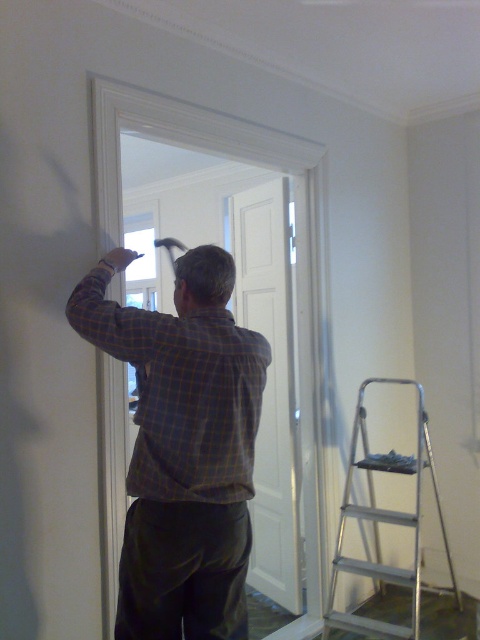
Question: Which point is farther to the camera?

Choices:
 (A) silver metallic step ladder at lower right
 (B) plaid shirt at center

Answer: (A)

Question: Among these points, which one is nearest to the camera?

Choices:
 (A) (203, 451)
 (B) (358, 412)

Answer: (A)

Question: Does plaid shirt at center have a greater width compared to silver metallic step ladder at lower right?

Choices:
 (A) no
 (B) yes

Answer: (A)

Question: Is plaid shirt at center bigger than silver metallic step ladder at lower right?

Choices:
 (A) yes
 (B) no

Answer: (B)

Question: Is plaid shirt at center thinner than silver metallic step ladder at lower right?

Choices:
 (A) no
 (B) yes

Answer: (B)